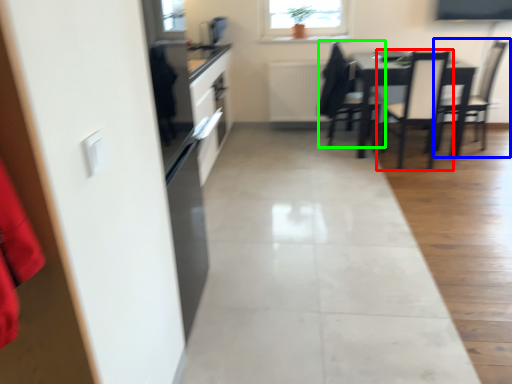
Question: Considering the real-world distances, which object is closest to chair (highlighted by a red box)? chair (highlighted by a blue box) or chair (highlighted by a green box).

Choices:
 (A) chair
 (B) chair

Answer: (A)